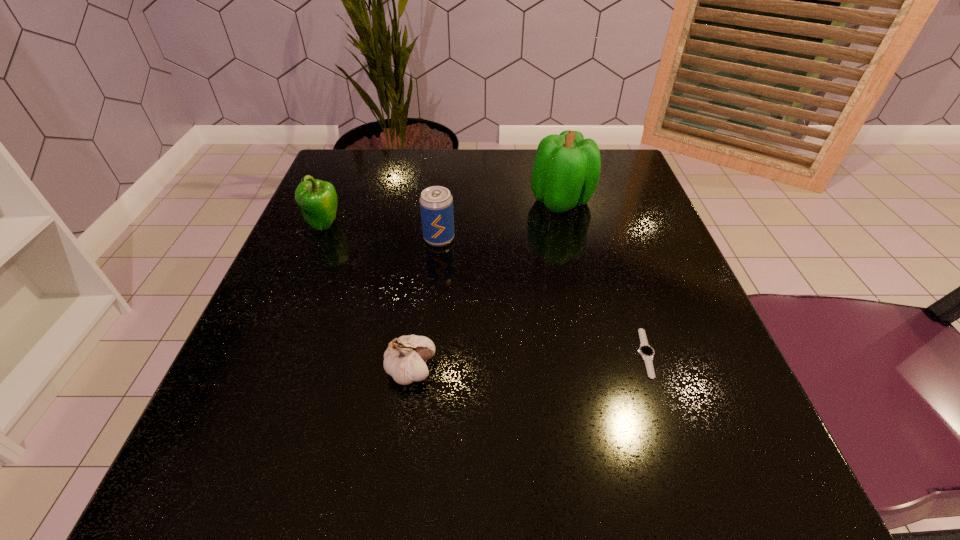
The width and height of the screenshot is (960, 540). I want to click on vacant space at the right edge of the desktop, so click(616, 215).

Where is `vacant space at the far right corner`? Image resolution: width=960 pixels, height=540 pixels. vacant space at the far right corner is located at coordinates (627, 205).

Identify the location of free region at the near right corner of the desktop. (666, 461).

The height and width of the screenshot is (540, 960). Identify the location of empty space between the right bell pepper and the beer can. (500, 220).

Image resolution: width=960 pixels, height=540 pixels. I want to click on free space between the shortest object and the beer can, so click(542, 296).

Identify the location of free space that is in between the beer can and the tallest object. The image size is (960, 540). (500, 220).

The height and width of the screenshot is (540, 960). I want to click on vacant point located between the garlic and the beer can, so click(x=425, y=304).

Locate an element on the screen. vacant point located between the watch and the beer can is located at coordinates (542, 296).

In order to click on vacant area between the beer can and the tallest object in this screenshot , I will do `click(500, 220)`.

Identify the location of vacant area between the right bell pepper and the shortest object. This screenshot has width=960, height=540. (604, 277).